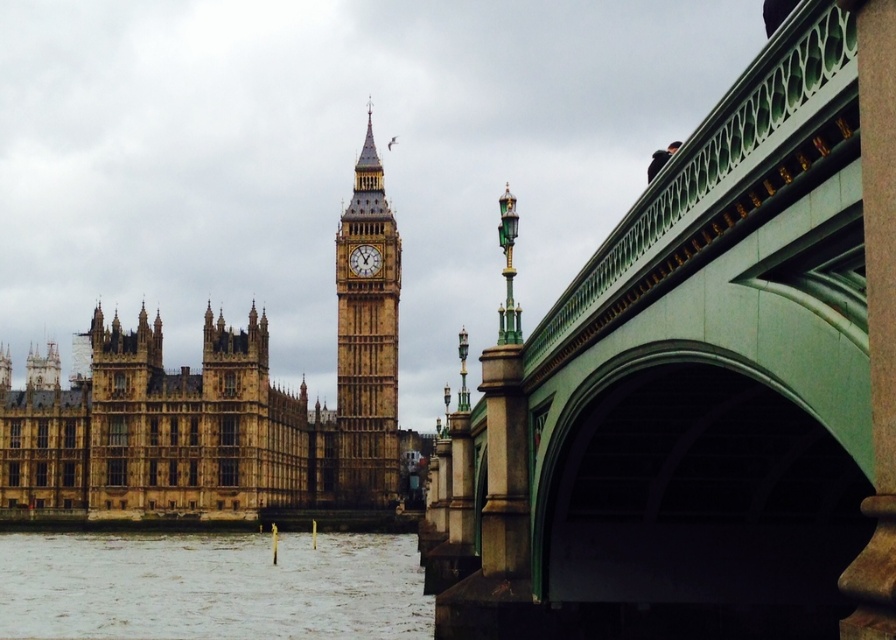
You are a tourist in London and want to take a photo of both the brown stone building at center and the golden stone clock at center. Which object should you focus on first to ensure both are in the frame?

You should focus on the brown stone building at center first because it is much taller than the golden stone clock at center, so you need to adjust your camera angle to include its full height while still capturing the golden stone clock at center in the same frame.

You are a tourist standing at the brown stone clock tower at center and want to take a photo of the green stone bridge at upper right. Considering the camera you have can only focus on objects within 50 meters, will you be able to capture a clear photo of the bridge?

The distance between the green stone bridge at upper right and the brown stone clock tower at center is 51.51 meters. Since your camera can only focus within 50 meters, you won the clear photo of the green stone bridge at upper right.

You are standing in front of the Palace of Westminster and notice two points marked on the building. One is labeled as point (x=395, y=282) and the other as point (x=355, y=268). Which point is closer to you?

Point (x=355, y=268) is closer to you because it is less further to the camera than point (x=395, y=282).